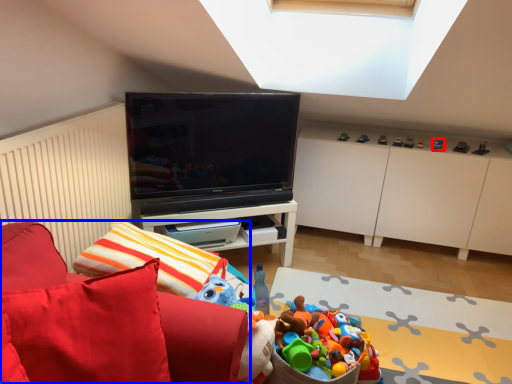
Question: Which of the following is the farthest to the observer, toy (highlighted by a red box) or furniture (highlighted by a blue box)?

Choices:
 (A) toy
 (B) furniture

Answer: (A)